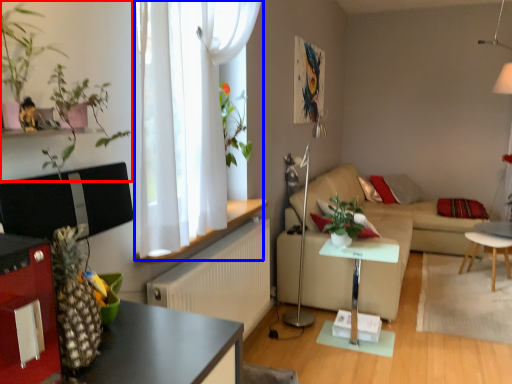
Question: Among these objects, which one is farthest to the camera, plant (highlighted by a red box) or curtain (highlighted by a blue box)?

Choices:
 (A) plant
 (B) curtain

Answer: (B)